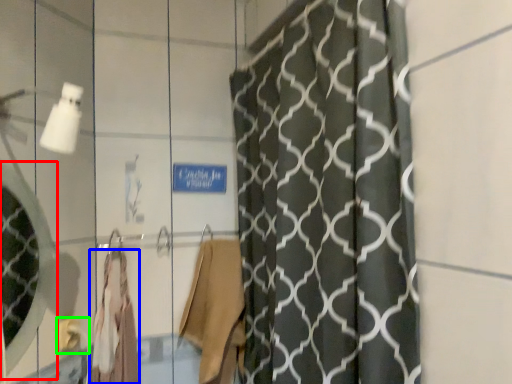
Question: Based on their relative distances, which object is nearer to mirror (highlighted by a red box)? Choose from robe (highlighted by a blue box) and towel bar (highlighted by a green box).

Choices:
 (A) robe
 (B) towel bar

Answer: (A)